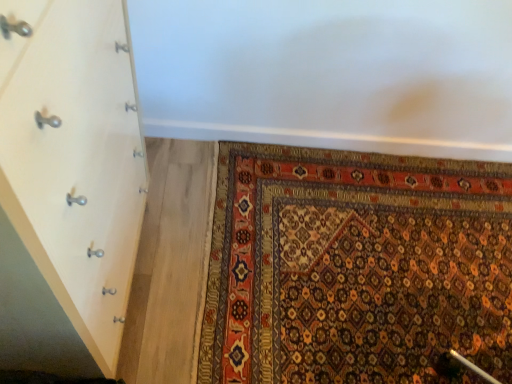
Describe the element at coordinates (356, 268) in the screenshot. The height and width of the screenshot is (384, 512). I see `carpet with intricate patterns at lower right` at that location.

Locate an element on the screen. carpet with intricate patterns at lower right is located at coordinates (356, 268).

In order to face white wood chest of drawers at left, should I rotate leftwards or rightwards?

Turn left approximately 28.020 degrees to face it.

Describe the element at coordinates (67, 185) in the screenshot. I see `white wood chest of drawers at left` at that location.

Measure the distance between point (x=92, y=90) and camera.

Point (x=92, y=90) is 30.20 inches away from camera.

At what (x,y) coordinates should I click in order to perform the action: click on white wood chest of drawers at left. Please return your answer as a coordinate pair (x, y). Looking at the image, I should click on coord(67,185).

Where is `carpet with intricate patterns at lower right`? This screenshot has width=512, height=384. carpet with intricate patterns at lower right is located at coordinates (356, 268).

Can you confirm if carpet with intricate patterns at lower right is positioned to the right of white wood chest of drawers at left?

Correct, you'll find carpet with intricate patterns at lower right to the right of white wood chest of drawers at left.

In the scene shown: Is carpet with intricate patterns at lower right closer to the viewer compared to white wood chest of drawers at left?

No, it is behind white wood chest of drawers at left.

Does point (464, 222) appear closer or farther from the camera than point (124, 315)?

Point (464, 222) appears to be farther away from the viewer than point (124, 315).

From the image's perspective, which object appears higher, carpet with intricate patterns at lower right or white wood chest of drawers at left?

white wood chest of drawers at left is shown above in the image.

From a real-world perspective, is carpet with intricate patterns at lower right over white wood chest of drawers at left?

Actually, carpet with intricate patterns at lower right is physically below white wood chest of drawers at left in the real world.

Can you confirm if carpet with intricate patterns at lower right is wider than white wood chest of drawers at left?

Yes.

Does carpet with intricate patterns at lower right have a lesser height compared to white wood chest of drawers at left?

Yes, carpet with intricate patterns at lower right is shorter than white wood chest of drawers at left.

Considering the relative sizes of carpet with intricate patterns at lower right and white wood chest of drawers at left in the image provided, is carpet with intricate patterns at lower right smaller than white wood chest of drawers at left?

Indeed, carpet with intricate patterns at lower right has a smaller size compared to white wood chest of drawers at left.

Is carpet with intricate patterns at lower right inside the boundaries of white wood chest of drawers at left, or outside?

carpet with intricate patterns at lower right is outside white wood chest of drawers at left.

Looking at this image, is the surface of carpet with intricate patterns at lower right in direct contact with white wood chest of drawers at left?

No, carpet with intricate patterns at lower right is not next to white wood chest of drawers at left.

Is white wood chest of drawers at left at the back of carpet with intricate patterns at lower right?

carpet with intricate patterns at lower right is not turned away from white wood chest of drawers at left.

What's the angular difference between carpet with intricate patterns at lower right and white wood chest of drawers at left's facing directions?

The facing directions of carpet with intricate patterns at lower right and white wood chest of drawers at left are 89.2 degrees apart.

Based on the photo, measure the distance between carpet with intricate patterns at lower right and white wood chest of drawers at left.

carpet with intricate patterns at lower right is 31.48 inches from white wood chest of drawers at left.

I want to click on chest of drawers in front of the carpet with intricate patterns at lower right, so click(67, 185).

Which object is positioned more to the left, white wood chest of drawers at left or carpet with intricate patterns at lower right?

Positioned to the left is white wood chest of drawers at left.

Who is more distant, white wood chest of drawers at left or carpet with intricate patterns at lower right?

carpet with intricate patterns at lower right is further from the camera.

Which is more distant, (50, 170) or (476, 358)?

The point (476, 358) is behind.

From the image's perspective, is white wood chest of drawers at left over carpet with intricate patterns at lower right?

Yes, from the image's perspective, white wood chest of drawers at left is above carpet with intricate patterns at lower right.

From a real-world perspective, is white wood chest of drawers at left physically located above or below carpet with intricate patterns at lower right?

In terms of real-world spatial position, white wood chest of drawers at left is above carpet with intricate patterns at lower right.

Looking at this image, considering the sizes of objects white wood chest of drawers at left and carpet with intricate patterns at lower right in the image provided, who is wider, white wood chest of drawers at left or carpet with intricate patterns at lower right?

Wider between the two is carpet with intricate patterns at lower right.

Is white wood chest of drawers at left shorter than carpet with intricate patterns at lower right?

No, white wood chest of drawers at left is not shorter than carpet with intricate patterns at lower right.

Considering the relative sizes of white wood chest of drawers at left and carpet with intricate patterns at lower right in the image provided, is white wood chest of drawers at left smaller than carpet with intricate patterns at lower right?

Actually, white wood chest of drawers at left might be larger than carpet with intricate patterns at lower right.

Is white wood chest of drawers at left positioned beyond the bounds of carpet with intricate patterns at lower right?

That's correct, white wood chest of drawers at left is outside of carpet with intricate patterns at lower right.

Is white wood chest of drawers at left beside carpet with intricate patterns at lower right?

No, white wood chest of drawers at left is not in contact with carpet with intricate patterns at lower right.

Is white wood chest of drawers at left oriented away from carpet with intricate patterns at lower right?

No, white wood chest of drawers at left is not facing away from carpet with intricate patterns at lower right.

How distant is white wood chest of drawers at left from carpet with intricate patterns at lower right?

white wood chest of drawers at left is 79.96 centimeters from carpet with intricate patterns at lower right.

In order to click on mat below the white wood chest of drawers at left (from the image's perspective) in this screenshot , I will do `click(356, 268)`.

Find the location of a particular element. The height and width of the screenshot is (384, 512). the chest of drawers that is above the carpet with intricate patterns at lower right (from the image's perspective) is located at coordinates (67, 185).

This screenshot has width=512, height=384. I want to click on chest of drawers in front of the carpet with intricate patterns at lower right, so click(x=67, y=185).